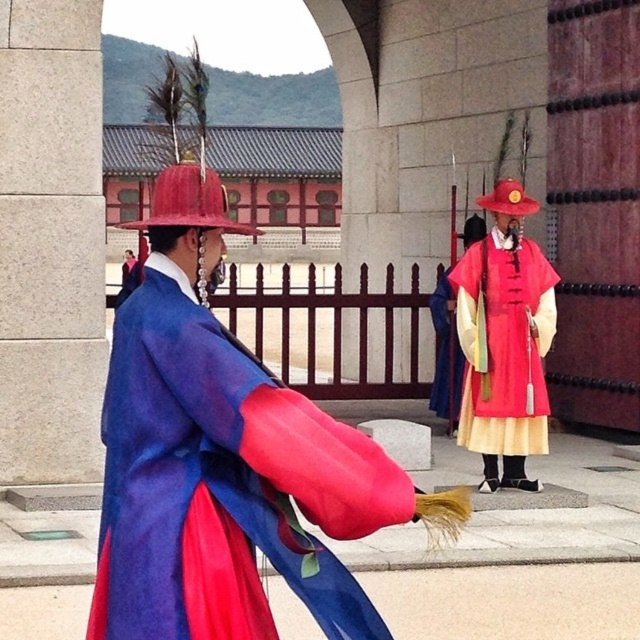
Question: Which object is farther from the camera taking this photo?

Choices:
 (A) matte red and yellow robe at center
 (B) matte blue silk robe at center

Answer: (A)

Question: Is matte blue silk robe at center to the right of matte red and yellow robe at center from the viewer's perspective?

Choices:
 (A) no
 (B) yes

Answer: (A)

Question: Among these objects, which one is nearest to the camera?

Choices:
 (A) matte red and yellow robe at center
 (B) matte blue silk robe at center

Answer: (B)

Question: Does matte blue silk robe at center appear on the left side of matte red and yellow robe at center?

Choices:
 (A) yes
 (B) no

Answer: (A)

Question: Among these objects, which one is nearest to the camera?

Choices:
 (A) matte blue silk robe at center
 (B) matte red and yellow robe at center

Answer: (A)

Question: Does matte blue silk robe at center have a greater width compared to matte red and yellow robe at center?

Choices:
 (A) yes
 (B) no

Answer: (A)